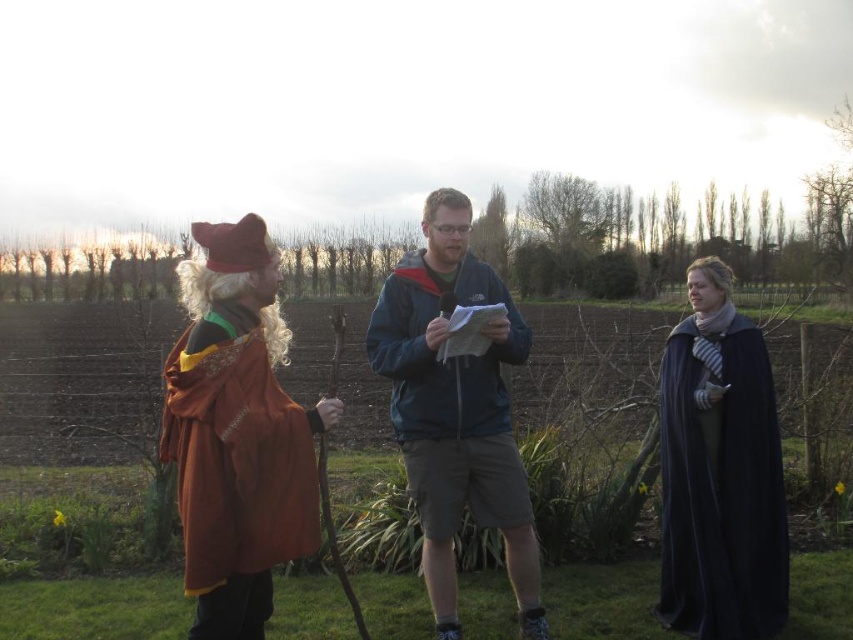
You are standing at point (236, 433). What object is located at this point?

The velvet orange cloak at left is located at point (236, 433).

Based on the coordinates provided, which object is located at point (456,410)?

The dark blue jacket at center is located at point (456,410).

You are a photographer trying to capture a group photo of the velvet orange cloak at left and the dark blue velvet cape at right. To ensure both are in frame, you need to know their relative positions. Which object is positioned to the left of the other?

The velvet orange cloak at left is positioned to the left of the dark blue velvet cape at right.